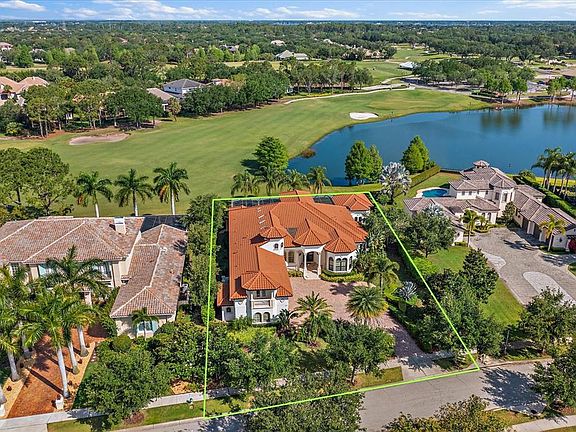
Locate an element on the screen. This screenshot has width=576, height=432. entry way to center home is located at coordinates (310, 264).